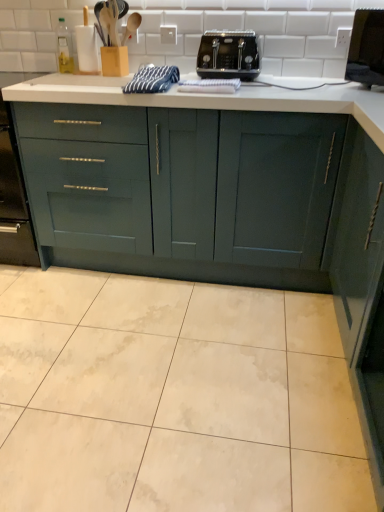
You are a GUI agent. You are given a task and a screenshot of the screen. Output one action in this format:
    pyautogui.click(x=<x>, y=<y>)
    Task: Click on the vacant point to the left of black plastic microwave at upper right
    This screenshot has height=512, width=384.
    Given the screenshot: What is the action you would take?
    pyautogui.click(x=316, y=84)